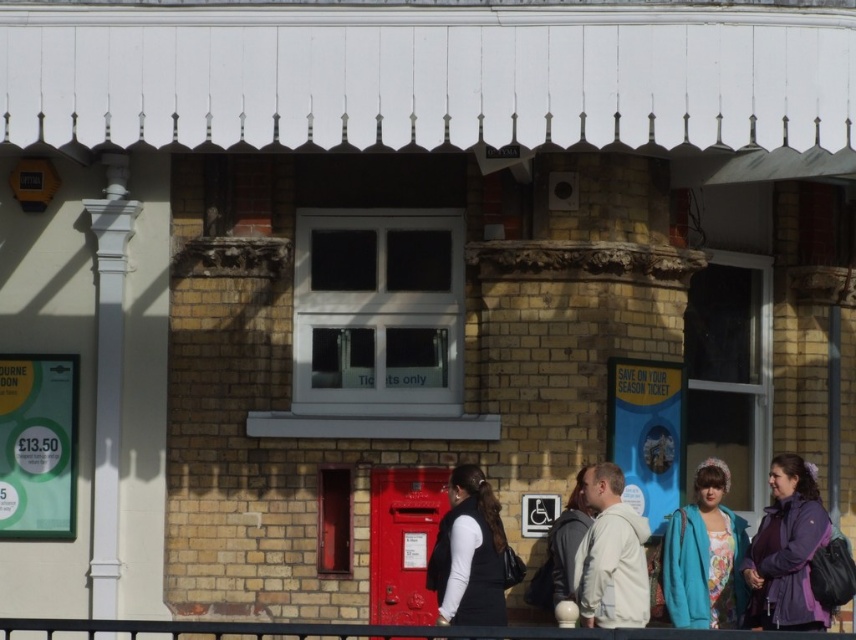
You are standing at the entrance of the building and see the teal fleece jacket at lower right and the metallic red rail at lower center. Which object is closer to the ground?

The teal fleece jacket at lower right is positioned under the metallic red rail at lower center, so it is closer to the ground.

You are an event organizer who needs to store two items temporarily. The teal fleece jacket at lower right and the black matte vest at center are both on a table. Which item requires more space to store?

The teal fleece jacket at lower right requires more space to store because it is larger in size than the black matte vest at center.

You are a visitor approaching the building and need to reach the black matte vest at center. Is the metallic red rail at lower center blocking your path to it?

The metallic red rail at lower center is in front of the black matte vest at center, so it is blocking your path to the black matte vest at center.